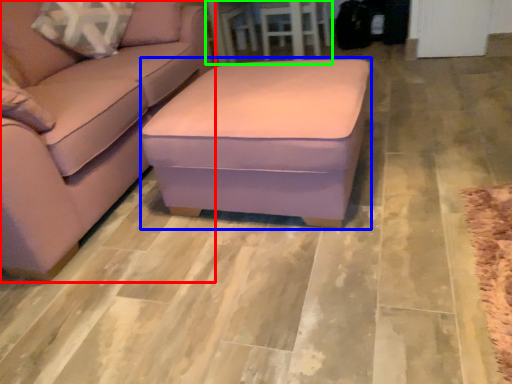
Question: Considering the real-world distances, which object is farthest from studio couch (highlighted by a red box)? stool (highlighted by a blue box) or table (highlighted by a green box)?

Choices:
 (A) stool
 (B) table

Answer: (B)